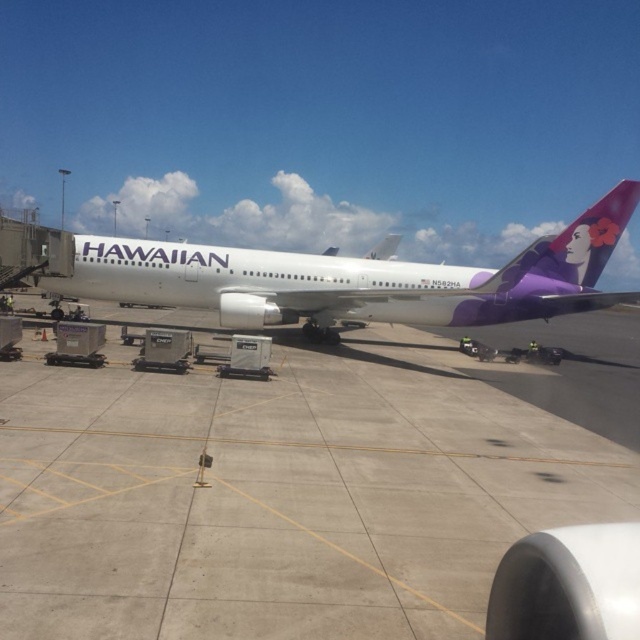
Between concrete at center and white glossy airplane at center, which one appears on the left side from the viewer's perspective?

Positioned to the left is concrete at center.

Who is shorter, concrete at center or white glossy airplane at center?

concrete at center is shorter.

Between point (468, 525) and point (296, 291), which one is positioned behind?

Point (296, 291)

Locate an element on the screen. Image resolution: width=640 pixels, height=640 pixels. concrete at center is located at coordinates (282, 493).